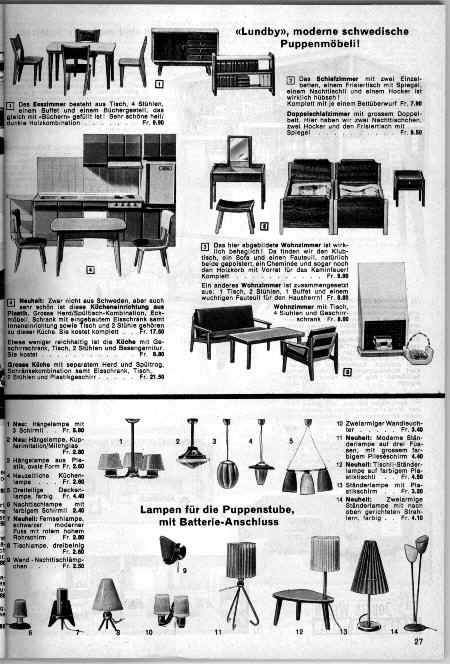
Locate an element on the screen. The width and height of the screenshot is (450, 664). power cords is located at coordinates (435, 629), (362, 614), (333, 619), (223, 589), (179, 564), (71, 627), (118, 619).